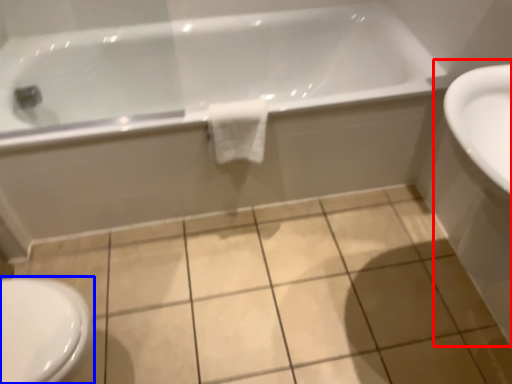
Question: Which of the following is the farthest to the observer, sink (highlighted by a red box) or bidet (highlighted by a blue box)?

Choices:
 (A) sink
 (B) bidet

Answer: (B)